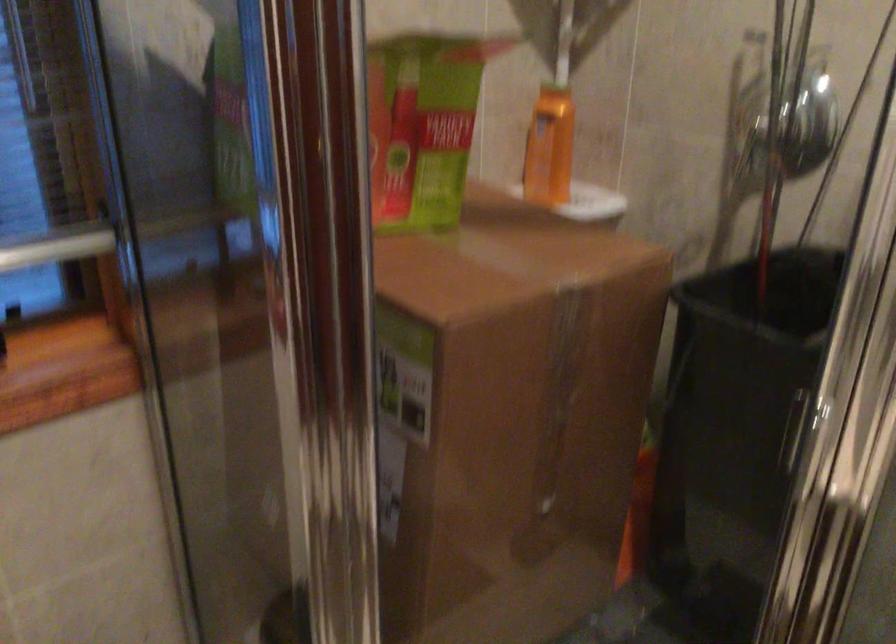
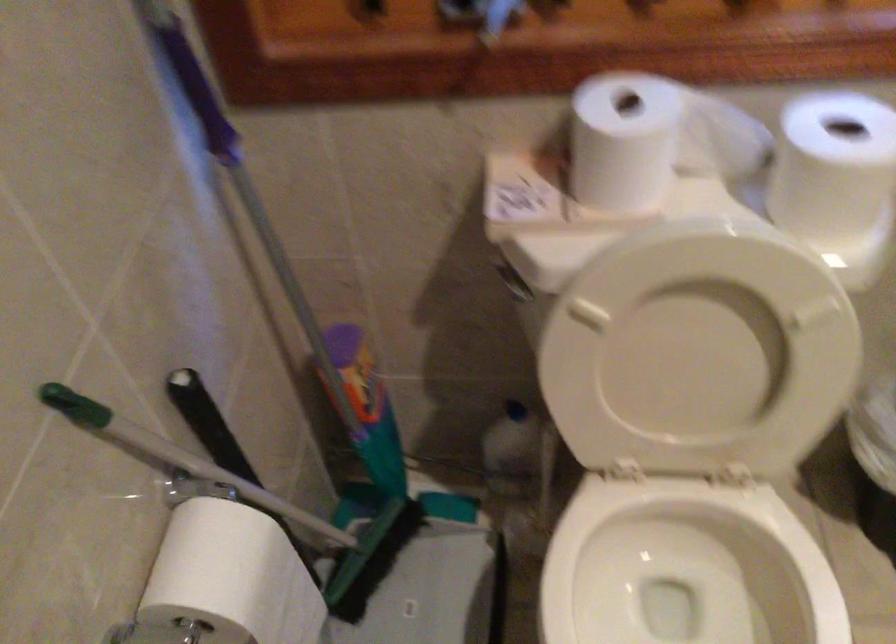
The images are taken continuously from a first-person perspective. In which direction is your viewpoint rotating?

The rotation direction of the camera is left-down.